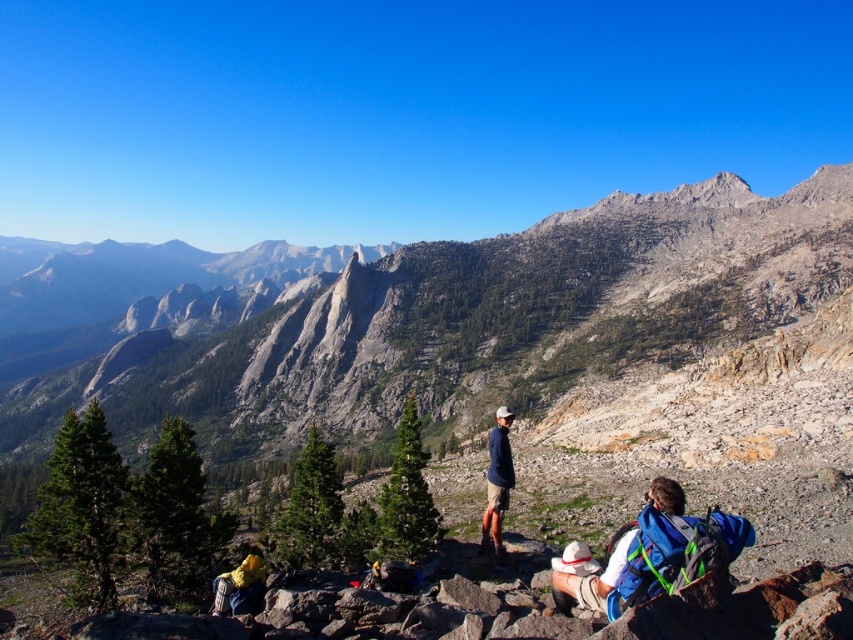
You are a hiker who wants to take a photo of the gray rocky mountain at center without the yellow fabric backpack at lower left appearing in the frame. Is it possible to do so by moving closer to the mountain?

The gray rocky mountain at center is larger in size compared to yellow fabric backpack at lower left. Moving closer to the mountain would make the backpack appear smaller in the frame, potentially allowing you to exclude it by adjusting your position.

You are a photographer positioned at the camera location. You want to capture both the point at coordinates point (13, 419) and point (254, 577) in your photo. Which point should you focus on first to ensure both are in focus?

You should focus on point (13, 419) first because it is closer to the camera than point (254, 577). By focusing on the closer point, the farther point will also be within the depth of field, ensuring both are in focus.

You are a photographer standing at the base of the gray rocky mountain at center. You want to capture a photo of the mountain with a drone. The drone can fly up to 50 meters away from you. Will the drone be able to reach the mountain?

The gray rocky mountain at center is 74.08 meters away from you, which exceeds the drone maximum range of 50 meters. The drone cannot reach the mountain.